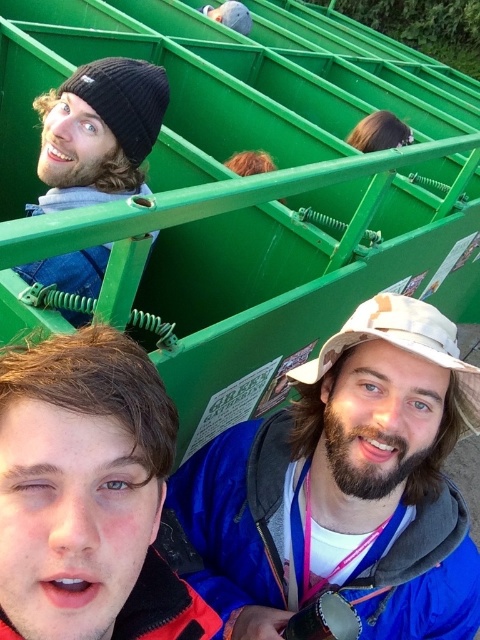
Question: Is matte blue jacket at lower left to the left of white fabric baseball hat at center from the viewer's perspective?

Choices:
 (A) no
 (B) yes

Answer: (B)

Question: Which point is closer to the camera taking this photo?

Choices:
 (A) (312, 376)
 (B) (133, 522)
 (C) (75, 180)
 (D) (334, 461)

Answer: (B)

Question: Can you confirm if beige fabric hat at center is bigger than matte blue jacket at lower left?

Choices:
 (A) yes
 (B) no

Answer: (A)

Question: Which of the following is the closest to the observer?

Choices:
 (A) pos(97,164)
 (B) pos(358,547)
 (C) pos(362,337)
 (D) pos(108,339)

Answer: (D)

Question: Does beige fabric hat at center have a larger size compared to black knit beanie at upper left?

Choices:
 (A) no
 (B) yes

Answer: (B)

Question: Which object is closer to the camera taking this photo?

Choices:
 (A) black knit beanie at upper left
 (B) matte blue jacket at lower left

Answer: (B)